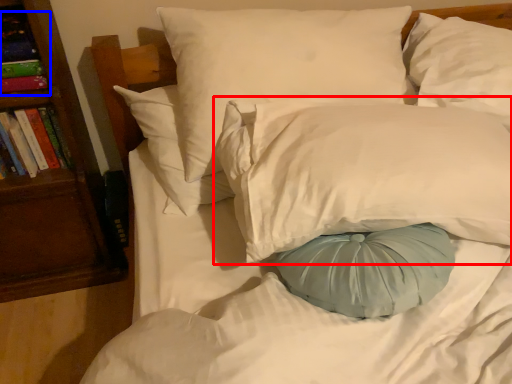
Question: Which point is further to the camera, pillow (highlighted by a red box) or book (highlighted by a blue box)?

Choices:
 (A) pillow
 (B) book

Answer: (B)